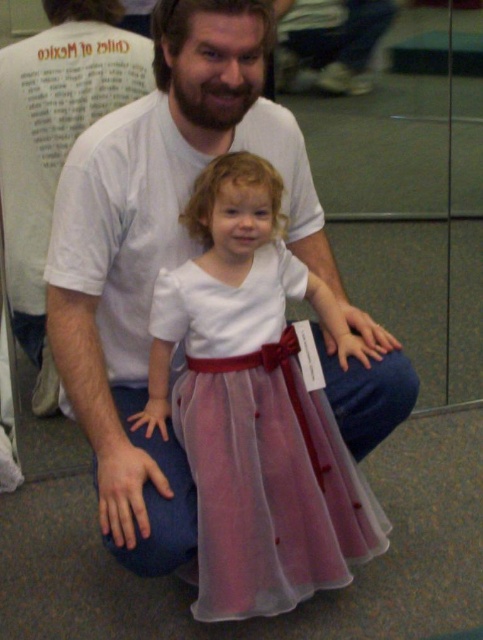
Question: Considering the relative positions of white cotton shirt at center and pale pink tulle dress at center in the image provided, where is white cotton shirt at center located with respect to pale pink tulle dress at center?

Choices:
 (A) above
 (B) below

Answer: (A)

Question: Which point appears farthest from the camera in this image?

Choices:
 (A) (101, 452)
 (B) (15, 67)

Answer: (B)

Question: Among these objects, which one is farthest from the camera?

Choices:
 (A) white cotton shirt at center
 (B) pale pink tulle dress at center
 (C) white t-shirt at center

Answer: (C)

Question: Estimate the real-world distances between objects in this image. Which object is farther from the pale pink tulle dress at center?

Choices:
 (A) white cotton shirt at center
 (B) white t-shirt at center

Answer: (B)

Question: Where is pale pink tulle dress at center located in relation to white t-shirt at center in the image?

Choices:
 (A) right
 (B) left

Answer: (A)

Question: Can you confirm if white cotton shirt at center is positioned above white t-shirt at center?

Choices:
 (A) no
 (B) yes

Answer: (A)